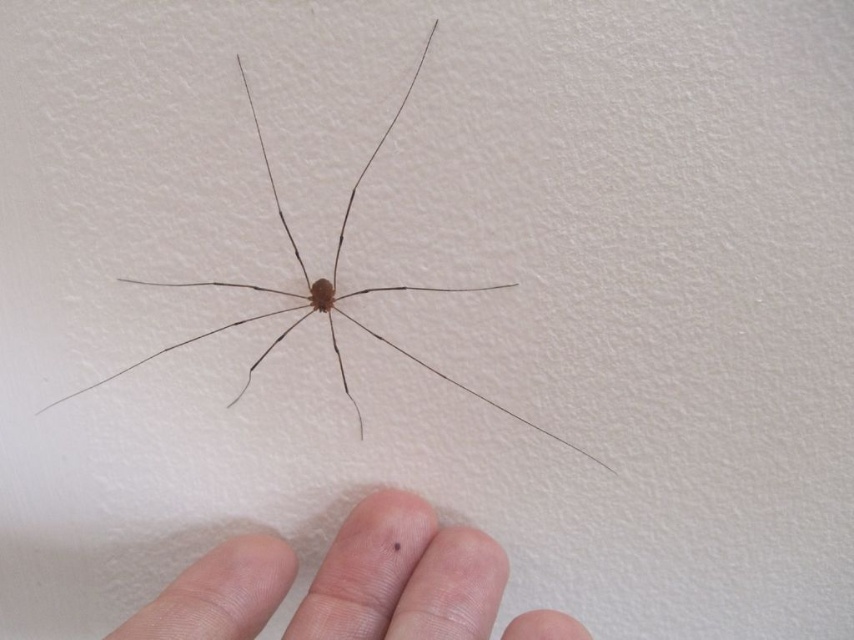
Question: Is pale skin finger at lower center thinner than brown matte spider at center?

Choices:
 (A) no
 (B) yes

Answer: (B)

Question: Which of the following is the closest to the observer?

Choices:
 (A) (190, 618)
 (B) (341, 234)

Answer: (A)

Question: Can you confirm if pale skin finger at lower center is wider than brown matte spider at center?

Choices:
 (A) yes
 (B) no

Answer: (B)

Question: Which of the following is the farthest from the observer?

Choices:
 (A) pale skin finger at lower center
 (B) brown matte spider at center

Answer: (B)

Question: Does pale skin finger at lower center appear under brown matte spider at center?

Choices:
 (A) yes
 (B) no

Answer: (A)